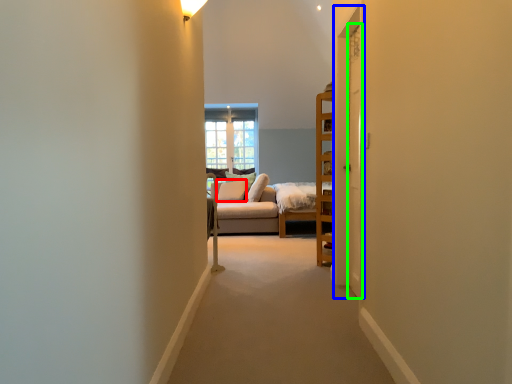
Question: Estimate the real-world distances between objects in this image. Which object is closer to pillow (highlighted by a red box), door (highlighted by a blue box) or door (highlighted by a green box)?

Choices:
 (A) door
 (B) door

Answer: (A)